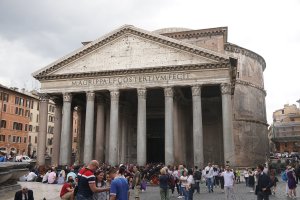
Locate an element on the screen. pillars is located at coordinates (228, 116), (198, 119), (169, 121), (142, 123), (112, 126), (88, 127), (66, 127), (55, 127), (39, 132), (101, 133).